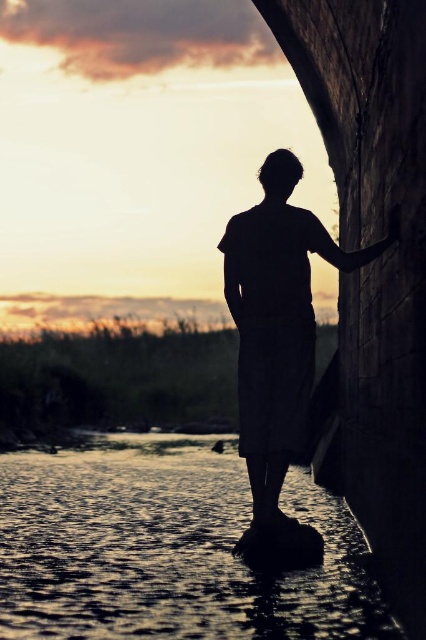
Measure the distance between shiny reflective water at lower center and silhouette fabric at center.

shiny reflective water at lower center and silhouette fabric at center are 3.08 meters apart.

Does shiny reflective water at lower center come behind silhouette fabric at center?

No, shiny reflective water at lower center is closer to the viewer.

Where is `shiny reflective water at lower center`? shiny reflective water at lower center is located at coordinates (167, 550).

I want to click on shiny reflective water at lower center, so click(167, 550).